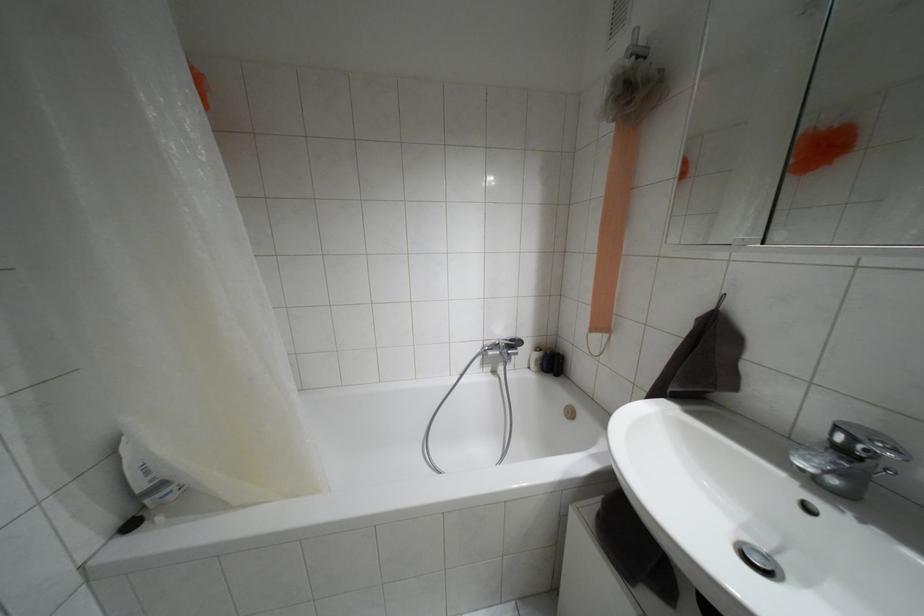
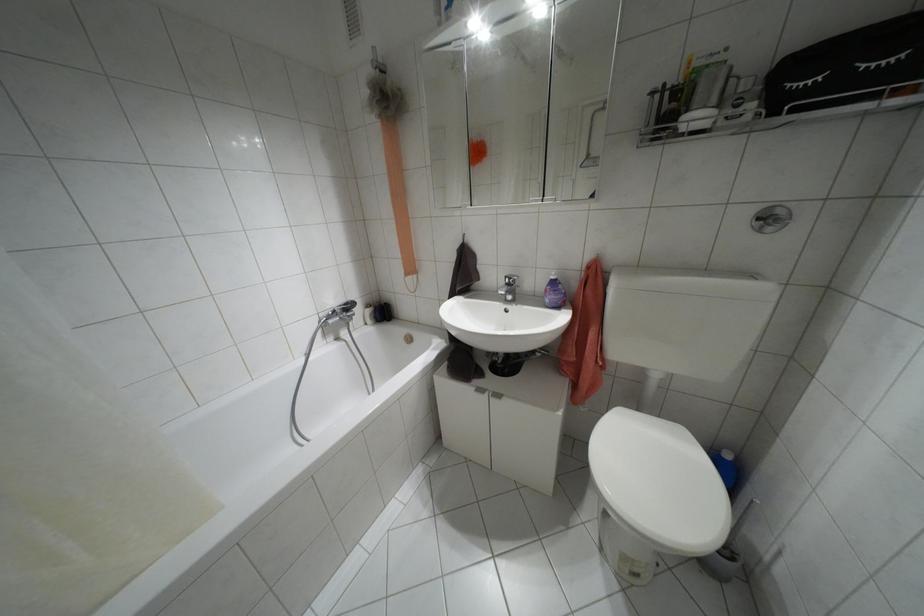
The point at (843, 450) is marked in the first image. Where is the corresponding point in the second image?

(507, 284)